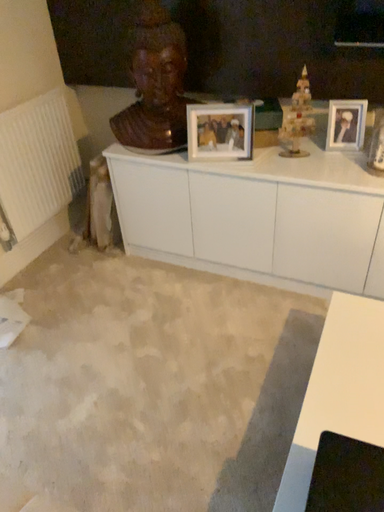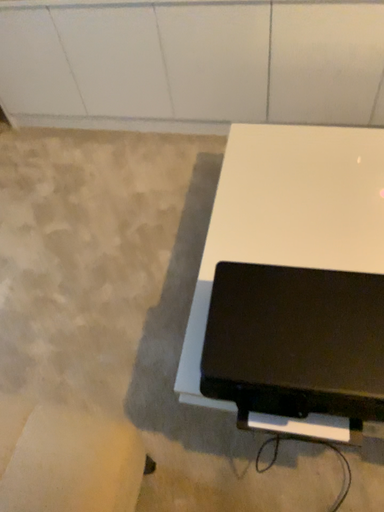
Question: Which way did the camera rotate in the video?

Choices:
 (A) rotated right
 (B) rotated left

Answer: (A)